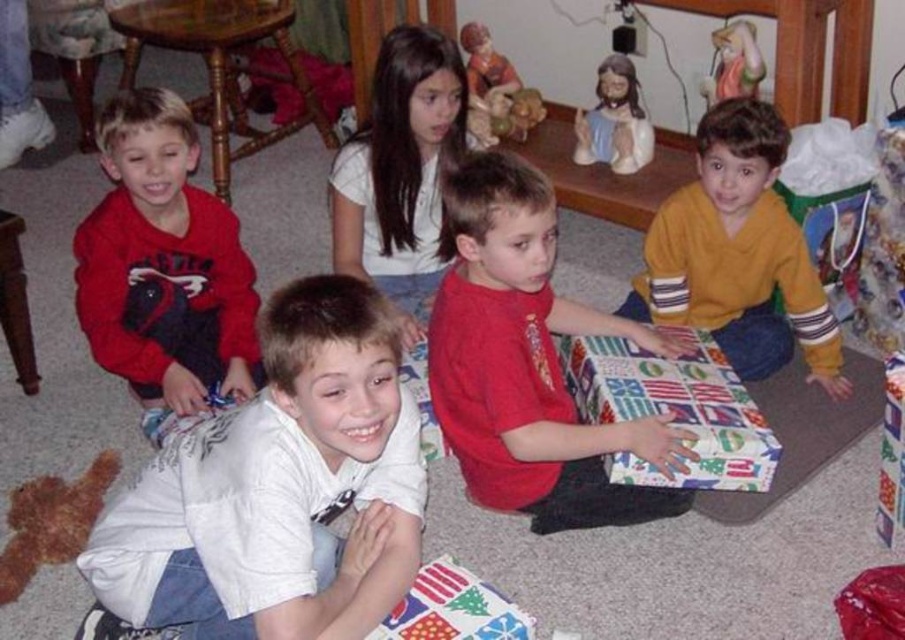
Question: Which of the following is the farthest from the observer?

Choices:
 (A) (537, 106)
 (B) (746, 72)
 (C) (605, 84)
 (D) (824, 342)

Answer: (A)

Question: Which of the following is the farthest from the observer?

Choices:
 (A) white cotton shirt at lower left
 (B) yellow fleece sweater at right

Answer: (B)

Question: Considering the relative positions of white cotton shirt at lower left and yellow fleece sweater at right in the image provided, where is white cotton shirt at lower left located with respect to yellow fleece sweater at right?

Choices:
 (A) left
 (B) right

Answer: (A)

Question: Is matte ceramic figurine at upper center wider than porcelain figurine at upper right?

Choices:
 (A) yes
 (B) no

Answer: (A)

Question: Is matte ceramic figurine at upper center to the left of porcelain figurine at upper right from the viewer's perspective?

Choices:
 (A) no
 (B) yes

Answer: (B)

Question: Which point is closer to the camera?

Choices:
 (A) matte red sweatshirt at left
 (B) matte ceramic figurine at upper center
 (C) matte red shirt at center
 (D) white cotton shirt at lower left

Answer: (D)